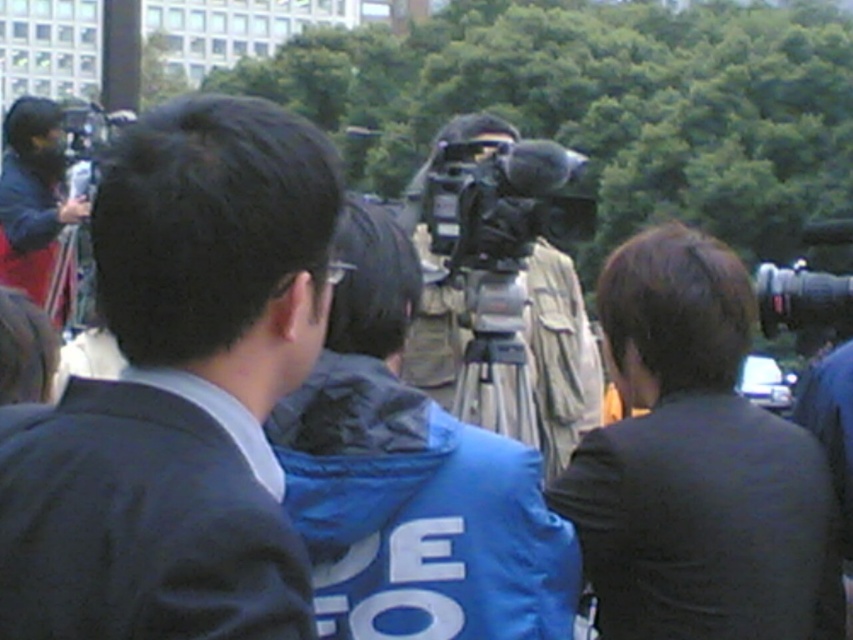
Is black matte suit at left below matte black camera at left?

Yes, black matte suit at left is below matte black camera at left.

The image size is (853, 640). What do you see at coordinates (178, 390) in the screenshot?
I see `black matte suit at left` at bounding box center [178, 390].

You are a GUI agent. You are given a task and a screenshot of the screen. Output one action in this format:
    pyautogui.click(x=<x>, y=<y>)
    Task: Click on the black matte suit at left
    The image size is (853, 640).
    Given the screenshot: What is the action you would take?
    pyautogui.click(x=178, y=390)

Which of these two, black matte suit at left or silver metallic tripod at center, stands taller?

With more height is black matte suit at left.

Where is `black matte suit at left`? black matte suit at left is located at coordinates (178, 390).

Does black matte suit at left have a greater height compared to black matte suit at right?

No.

Can you confirm if black matte suit at left is positioned below black matte suit at right?

Yes.

Is point (85, 428) positioned behind point (628, 401)?

No, it is not.

The height and width of the screenshot is (640, 853). I want to click on black matte suit at left, so click(178, 390).